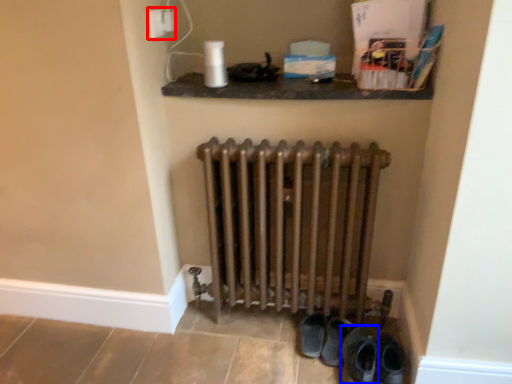
Question: Which object appears farthest to the camera in this image, electric outlet (highlighted by a red box) or footwear (highlighted by a blue box)?

Choices:
 (A) electric outlet
 (B) footwear

Answer: (A)